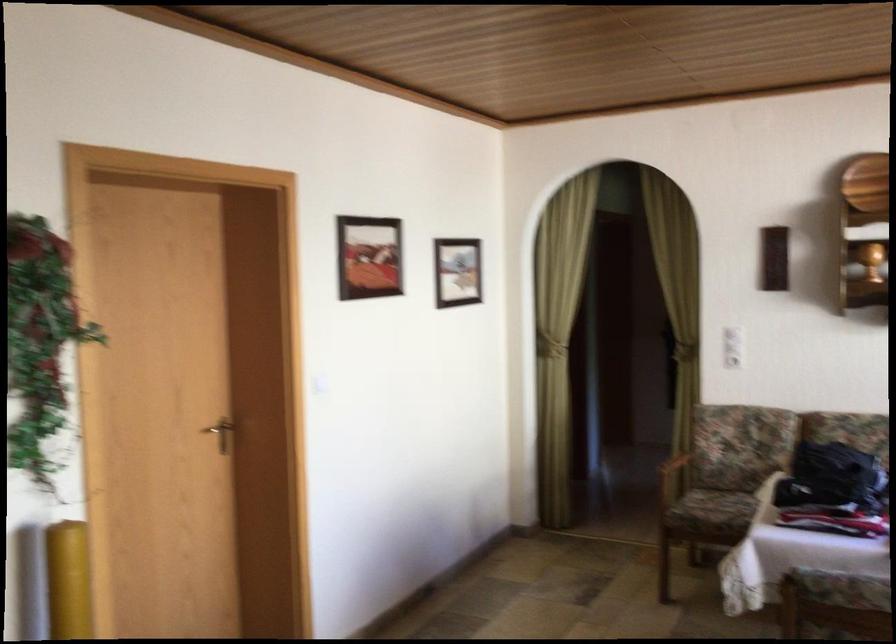
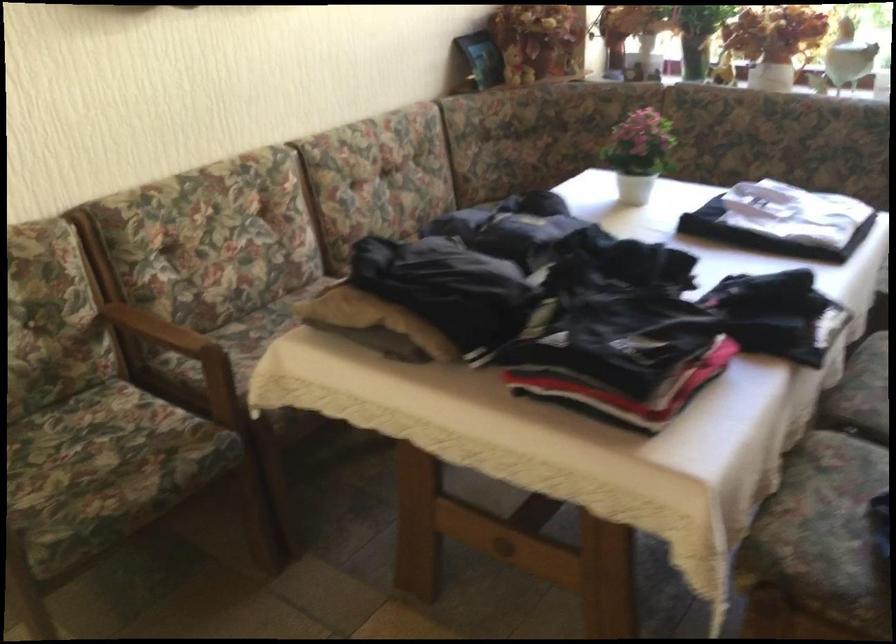
Locate, in the second image, the point that corresponds to the point at 825,478 in the first image.

(589, 317)